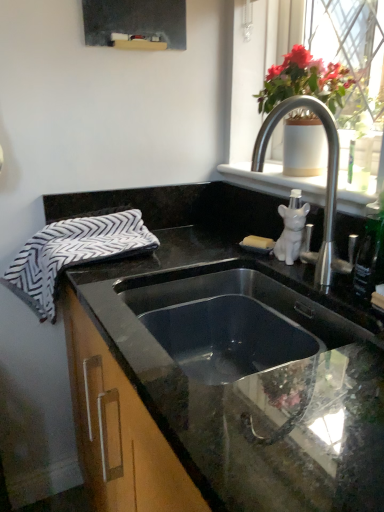
Question: In the image, is white ceramic vase at upper right positioned in front of or behind black and white zigzag beach towel at left?

Choices:
 (A) behind
 (B) front

Answer: (B)

Question: Do you think white ceramic vase at upper right is within black and white zigzag beach towel at left, or outside of it?

Choices:
 (A) inside
 (B) outside

Answer: (B)

Question: Which of these objects is positioned closest to the white ceramic dog at upper right?

Choices:
 (A) white ceramic vase at upper right
 (B) white ceramic vase at upper right
 (C) satin nickel faucet at upper right
 (D) black and white zigzag beach towel at left
 (E) white matte soap dispenser at upper right

Answer: (E)

Question: Based on their relative distances, which object is nearer to the white matte soap dispenser at upper right?

Choices:
 (A) white ceramic dog at upper right
 (B) black granite countertop at center
 (C) white ceramic vase at upper right
 (D) white ceramic vase at upper right
 (E) satin nickel faucet at upper right

Answer: (D)